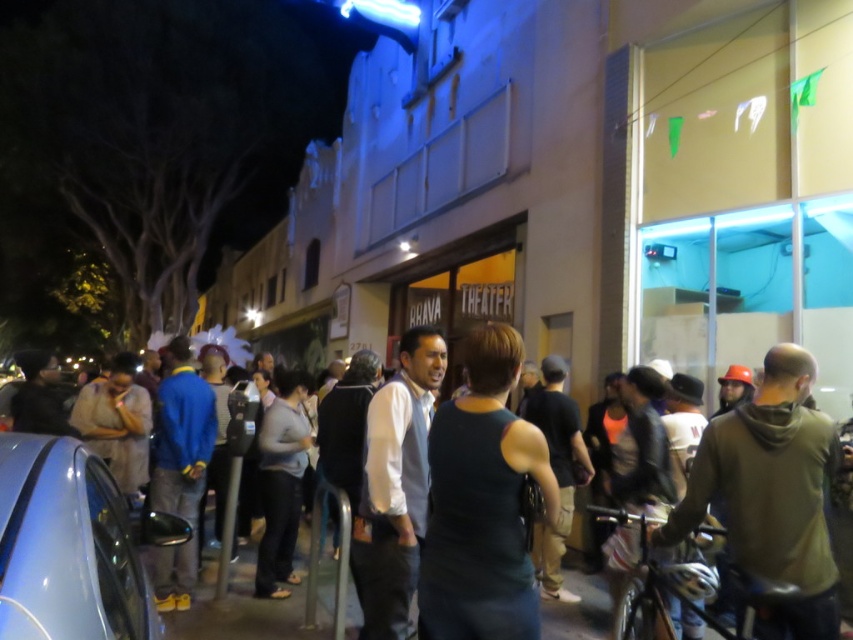
You are a photographer standing at the entrance of the Brava Theater. You want to take a photo of the metallic blue car at lower left and the dark gray tank top at center in the same frame. Which object should you focus on first if you want to ensure both are in focus?

The metallic blue car at lower left is much taller than the dark gray tank top at center, so you should focus on the metallic blue car at lower left first to ensure both are in focus.

You are at the Brava Theater entrance and notice two people wearing green clothing. The first person has a dark green tank top at center, and the second has a green hoodie at center. From your perspective, which clothing item is positioned higher?

The dark green tank top at center is above the green hoodie at center, so the dark green tank top at center is positioned higher.